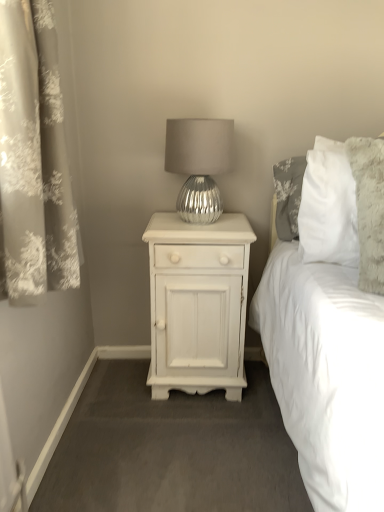
Question: Is point (182, 147) positioned closer to the camera than point (21, 156)?

Choices:
 (A) closer
 (B) farther

Answer: (B)

Question: Looking at the image, does silver metallic lamp at center seem bigger or smaller compared to silvery floral curtain at left?

Choices:
 (A) small
 (B) big

Answer: (A)

Question: Considering the real-world distances, which object is closest to the silver metallic lamp at center?

Choices:
 (A) silvery floral curtain at left
 (B) white painted wood nightstand at center

Answer: (B)

Question: Estimate the real-world distances between objects in this image. Which object is closer to the silvery floral curtain at left?

Choices:
 (A) silver metallic lamp at center
 (B) white painted wood nightstand at center

Answer: (A)